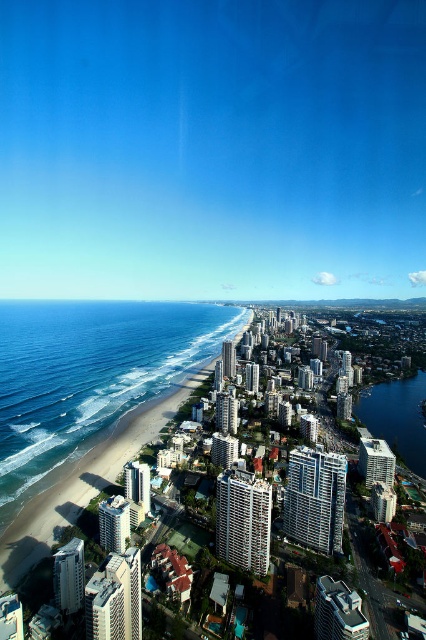
You are standing at the beach and want to take a photo of both the blue water at beach left and the blue glassy water at right. Which one should you point your camera towards first to capture them both in the frame?

You should point your camera towards the blue water at beach left first because it is closer to you than the blue glassy water at right, allowing both to be captured in the frame.

You are a drone operator planning to capture a photo of the blue water at beach left and the blue glassy water at right from the same altitude. Based on their heights, which area should you focus on to ensure both are visible in the frame without needing to adjust the camera angle?

The blue water at beach left is taller than the blue glassy water at right, so focusing on the blue water at beach left will ensure both areas are visible since it is higher and likely occupies more vertical space in the frame.